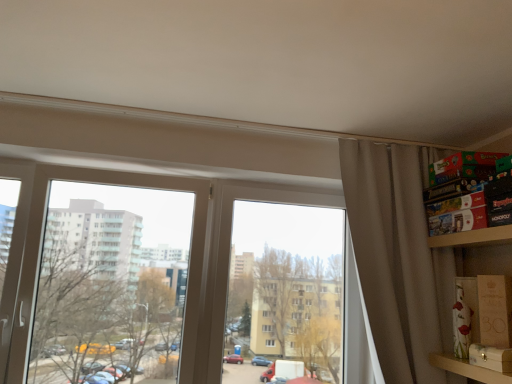
Question: From the image's perspective, is wooden box at right, which is the second cardboard box from back to front, located beneath transparent glass window at left?

Choices:
 (A) no
 (B) yes

Answer: (B)

Question: From a real-world perspective, is wooden box at right, the 1th cardboard box when ordered from front to back, physically below transparent glass window at left?

Choices:
 (A) no
 (B) yes

Answer: (B)

Question: Considering the relative sizes of wooden box at right, which is the second cardboard box from back to front, and transparent glass window at left in the image provided, is wooden box at right, which is the second cardboard box from back to front, wider than transparent glass window at left?

Choices:
 (A) no
 (B) yes

Answer: (A)

Question: Does wooden box at right, the 1th cardboard box when ordered from front to back, lie behind transparent glass window at left?

Choices:
 (A) no
 (B) yes

Answer: (A)

Question: Could you tell me if wooden box at right, which is the second cardboard box from back to front, is facing transparent glass window at left?

Choices:
 (A) no
 (B) yes

Answer: (B)

Question: In terms of width, does transparent glass window at center look wider or thinner when compared to wooden at right?

Choices:
 (A) wide
 (B) thin

Answer: (B)

Question: Considering their positions, is transparent glass window at center located in front of or behind wooden at right?

Choices:
 (A) front
 (B) behind

Answer: (B)

Question: From their relative heights in the image, would you say transparent glass window at center is taller or shorter than wooden at right?

Choices:
 (A) tall
 (B) short

Answer: (A)

Question: In terms of size, does transparent glass window at center appear bigger or smaller than wooden at right?

Choices:
 (A) small
 (B) big

Answer: (B)

Question: Is point (483, 306) closer or farther from the camera than point (487, 375)?

Choices:
 (A) closer
 (B) farther

Answer: (B)

Question: Is matte brown cardboard box at lower right, which is the 2th cardboard box from front to back, spatially inside wooden at right, or outside of it?

Choices:
 (A) outside
 (B) inside

Answer: (A)

Question: In terms of width, does matte brown cardboard box at lower right, which is the 2th cardboard box from front to back, look wider or thinner when compared to wooden at right?

Choices:
 (A) wide
 (B) thin

Answer: (B)

Question: From a real-world perspective, is matte brown cardboard box at lower right, which is the 2th cardboard box from front to back, positioned above or below wooden at right?

Choices:
 (A) above
 (B) below

Answer: (A)

Question: Looking at their shapes, would you say wooden box at right, the 1th cardboard box when ordered from front to back, is wider or thinner than matte brown cardboard box at lower right, which is the 2th cardboard box from front to back?

Choices:
 (A) thin
 (B) wide

Answer: (A)

Question: From a real-world perspective, is wooden box at right, the 1th cardboard box when ordered from front to back, physically located above or below matte brown cardboard box at lower right, the 1th cardboard box in the back-to-front sequence?

Choices:
 (A) below
 (B) above

Answer: (A)